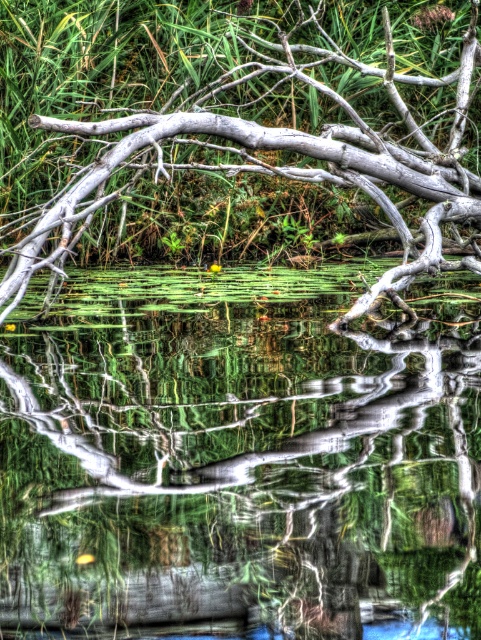
You are standing at the edge of the water in the serene natural scene. There is a point marked at coordinates (x=240, y=458). What is located at this point?

The point at coordinates (x=240, y=458) marks transparent water at center.

You are an artist trying to paint this scene. You want to ensure that the transparent water at center and the gray wood tree branch at upper center are proportionally accurate. Which object should you make wider in your painting?

The transparent water at center should be made wider in the painting since its width is larger than the gray wood tree branch at upper center according to the description.

You are an artist trying to paint the scene. You want to ensure the transparent water at center and the gray wood tree branch at upper center are proportionally accurate. Which object should you paint first to maintain the correct size relationship between them?

You should paint the gray wood tree branch at upper center first because the transparent water at center is larger in size, allowing you to adjust its dimensions relative to the branch afterward.